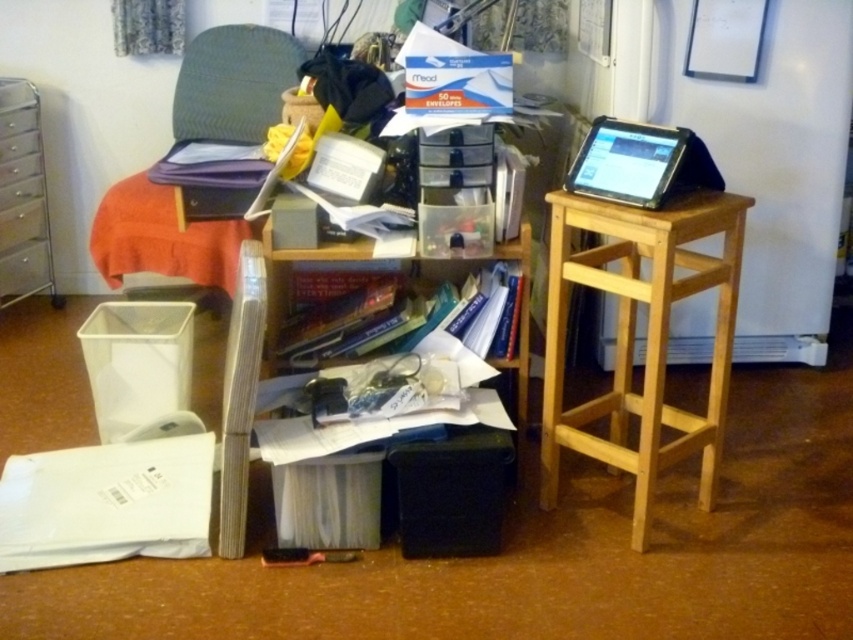
You are organizing the workspace and need to place a new item between the textured fabric chair at upper left and the black matte tablet at upper right. Considering their sizes, which object should you place closer to the center of the workspace to maintain balance?

Since the textured fabric chair at upper left is larger in size than the black matte tablet at upper right, placing the larger textured fabric chair at upper left farther from the center and the smaller black matte tablet at upper right closer to the center would help balance the workspace.

Looking at this image, you are trying to reach the black matte tablet at upper right but there is a natural wood side table at right blocking your view. Can you see the tablet from your current position?

The natural wood side table at right is in front of the black matte tablet at upper right, so it is blocking your view. You cannot see the tablet.

You are organizing the office and need to move the metallic silver file cabinet at left closer to the entrance. However, there is a textured fabric chair at upper left in the way. Can the file cabinet be moved around the chair without disassembling either?

The textured fabric chair at upper left is larger in size than metallic silver file cabinet at left. Since the chair is bigger, it might block the path. You would need to move the chair first to make space for moving the file cabinet.